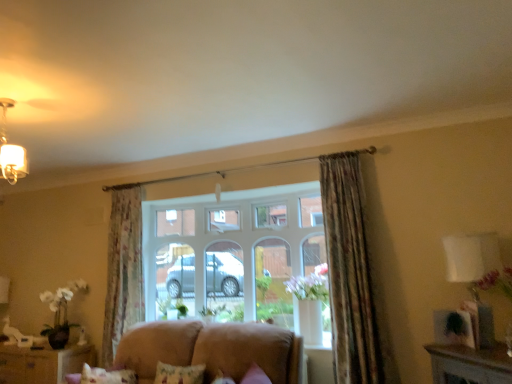
Measure the distance between white fabric lampshade at right and camera.

white fabric lampshade at right is 2.38 meters away from camera.

I want to click on floral fabric curtain at upper right, the second curtain in the back-to-front sequence, so click(349, 272).

Find the location of a particular element. This screenshot has width=512, height=384. suede-like beige sofa at lower center is located at coordinates (211, 349).

Can we say white fabric lampshade at right lies outside floral fabric curtain at upper right, marked as the first curtain in a front-to-back arrangement?

white fabric lampshade at right is positioned outside floral fabric curtain at upper right, marked as the first curtain in a front-to-back arrangement.

Which of these two, white fabric lampshade at right or floral fabric curtain at upper right, the second curtain in the back-to-front sequence, is smaller?

white fabric lampshade at right is smaller.

Can you see white fabric lampshade at right touching floral fabric curtain at upper right, the second curtain in the back-to-front sequence?

There is a gap between white fabric lampshade at right and floral fabric curtain at upper right, the second curtain in the back-to-front sequence.

From the picture: From a real-world perspective, is white fabric lampshade at right over floral fabric curtain at upper right, arranged as the first curtain when viewed from the right?

No, from a real-world perspective, white fabric lampshade at right is not over floral fabric curtain at upper right, arranged as the first curtain when viewed from the right

In the image, is brown wooden cabinet at lower left positioned in front of or behind suede-like beige sofa at lower center?

brown wooden cabinet at lower left is positioned farther from the viewer than suede-like beige sofa at lower center.

Is brown wooden cabinet at lower left not close to suede-like beige sofa at lower center?

That's right, there is a large distance between brown wooden cabinet at lower left and suede-like beige sofa at lower center.

From the image's perspective, between brown wooden cabinet at lower left and suede-like beige sofa at lower center, which one is located above?

From the image's view, suede-like beige sofa at lower center is above.

How different are the orientations of brown wooden cabinet at lower left and suede-like beige sofa at lower center in degrees?

There is a 0.695-degree angle between the facing directions of brown wooden cabinet at lower left and suede-like beige sofa at lower center.

What's the angular difference between fluffy pink pillow at lower center and brown wooden cabinet at lower left's facing directions?

The angular difference between fluffy pink pillow at lower center and brown wooden cabinet at lower left is 4.23 degrees.

Locate an element on the screen. furniture behind the fluffy pink pillow at lower center is located at coordinates (42, 364).

From the image's perspective, is fluffy pink pillow at lower center above brown wooden cabinet at lower left?

Indeed, from the image's perspective, fluffy pink pillow at lower center is shown above brown wooden cabinet at lower left.

Relative to brown wooden cabinet at lower left, is fluffy pink pillow at lower center in front or behind?

Visually, fluffy pink pillow at lower center is located in front of brown wooden cabinet at lower left.

Is floral fabric curtain at upper right, arranged as the first curtain when viewed from the right, directly adjacent to brown wooden cabinet at lower left?

floral fabric curtain at upper right, arranged as the first curtain when viewed from the right, and brown wooden cabinet at lower left are clearly separated.

Is floral fabric curtain at upper right, the second curtain in the back-to-front sequence, closer to camera compared to brown wooden cabinet at lower left?

Yes, floral fabric curtain at upper right, the second curtain in the back-to-front sequence, is closer to the viewer.

Who is shorter, floral fabric curtain at upper right, arranged as the first curtain when viewed from the right, or brown wooden cabinet at lower left?

brown wooden cabinet at lower left.

From a real-world perspective, is white fabric lampshade at right positioned above or below fluffy pink pillow at lower center?

white fabric lampshade at right is above fluffy pink pillow at lower center.

Is white fabric lampshade at right positioned beyond the bounds of fluffy pink pillow at lower center?

Absolutely, white fabric lampshade at right is external to fluffy pink pillow at lower center.

From the image's perspective, is white fabric lampshade at right below fluffy pink pillow at lower center?

No.

From the image's perspective, is floral fabric curtain at upper right, placed as the second curtain when sorted from left to right, under suede-like beige sofa at lower center?

No, from the image's perspective, floral fabric curtain at upper right, placed as the second curtain when sorted from left to right, is not beneath suede-like beige sofa at lower center.

The image size is (512, 384). In order to click on studio couch in front of the floral fabric curtain at upper right, placed as the second curtain when sorted from left to right in this screenshot , I will do `click(211, 349)`.

Is floral fabric curtain at left, the 2th curtain from the front, oriented away from suede-like beige sofa at lower center?

floral fabric curtain at left, the 2th curtain from the front, does not have its back to suede-like beige sofa at lower center.

Does floral fabric curtain at left, the second curtain positioned from the right, have a lesser width compared to suede-like beige sofa at lower center?

Correct, the width of floral fabric curtain at left, the second curtain positioned from the right, is less than that of suede-like beige sofa at lower center.

Based on the photo, how far apart are floral fabric curtain at left, the second curtain positioned from the right, and suede-like beige sofa at lower center?

floral fabric curtain at left, the second curtain positioned from the right, is 38.15 inches from suede-like beige sofa at lower center.

Based on the photo, from a real-world perspective, which object stands above the other?

In real-world perspective, floral fabric curtain at left, the 1th curtain from the back, is above.

Where is `lamp on the right of floral fabric curtain at upper right, marked as the first curtain in a front-to-back arrangement`? This screenshot has width=512, height=384. lamp on the right of floral fabric curtain at upper right, marked as the first curtain in a front-to-back arrangement is located at coordinates pyautogui.click(x=474, y=277).

The image size is (512, 384). There is a brown wooden cabinet at lower left. In order to click on studio couch above it (from a real-world perspective) in this screenshot , I will do `click(211, 349)`.

Considering their positions, is floral fabric curtain at left, the 2th curtain from the front, positioned closer to white fabric lampshade at right than fluffy pink pillow at lower center?

fluffy pink pillow at lower center is positioned closer to the anchor white fabric lampshade at right.

Looking at the image, which one is located closer to suede-like beige sofa at lower center, brown wooden cabinet at lower left or floral fabric curtain at left, the 1th curtain positioned from the left?

Among the two, floral fabric curtain at left, the 1th curtain positioned from the left, is located nearer to suede-like beige sofa at lower center.

Estimate the real-world distances between objects in this image. Which object is further from floral fabric curtain at upper right, placed as the second curtain when sorted from left to right, white fabric lampshade at right or brown wooden cabinet at lower left?

Based on the image, brown wooden cabinet at lower left appears to be further to floral fabric curtain at upper right, placed as the second curtain when sorted from left to right.

From the image, which object appears to be farther from fluffy pink pillow at lower center, brown wooden cabinet at lower left or white fabric lampshade at right?

The object further to fluffy pink pillow at lower center is white fabric lampshade at right.

Looking at the image, which one is located further to brown wooden cabinet at lower left, fluffy pink pillow at lower center or white fabric lampshade at right?

white fabric lampshade at right is positioned further to the anchor brown wooden cabinet at lower left.

Estimate the real-world distances between objects in this image. Which object is further from floral fabric curtain at upper right, arranged as the first curtain when viewed from the right, brown wooden cabinet at lower left or suede-like beige sofa at lower center?

brown wooden cabinet at lower left is further to floral fabric curtain at upper right, arranged as the first curtain when viewed from the right.

Based on their spatial positions, is floral fabric curtain at upper right, arranged as the first curtain when viewed from the right, or floral fabric curtain at left, the 1th curtain positioned from the left, closer to brown wooden cabinet at lower left?

floral fabric curtain at left, the 1th curtain positioned from the left, is positioned closer to the anchor brown wooden cabinet at lower left.

Considering their positions, is suede-like beige sofa at lower center positioned further to white fabric lampshade at right than floral fabric curtain at upper right, placed as the second curtain when sorted from left to right?

suede-like beige sofa at lower center.

Locate an element on the screen. studio couch between floral fabric curtain at left, the 2th curtain from the front, and floral fabric curtain at upper right, the second curtain in the back-to-front sequence, from left to right is located at coordinates (211, 349).

Identify the location of studio couch between brown wooden cabinet at lower left and white fabric lampshade at right from left to right. This screenshot has height=384, width=512. (211, 349).

I want to click on pillow between floral fabric curtain at left, the 2th curtain from the front, and floral fabric curtain at upper right, arranged as the first curtain when viewed from the right, in the horizontal direction, so click(x=179, y=374).

What are the coordinates of `pillow between suede-like beige sofa at lower center and floral fabric curtain at left, the second curtain positioned from the right, from front to back` in the screenshot? It's located at (179, 374).